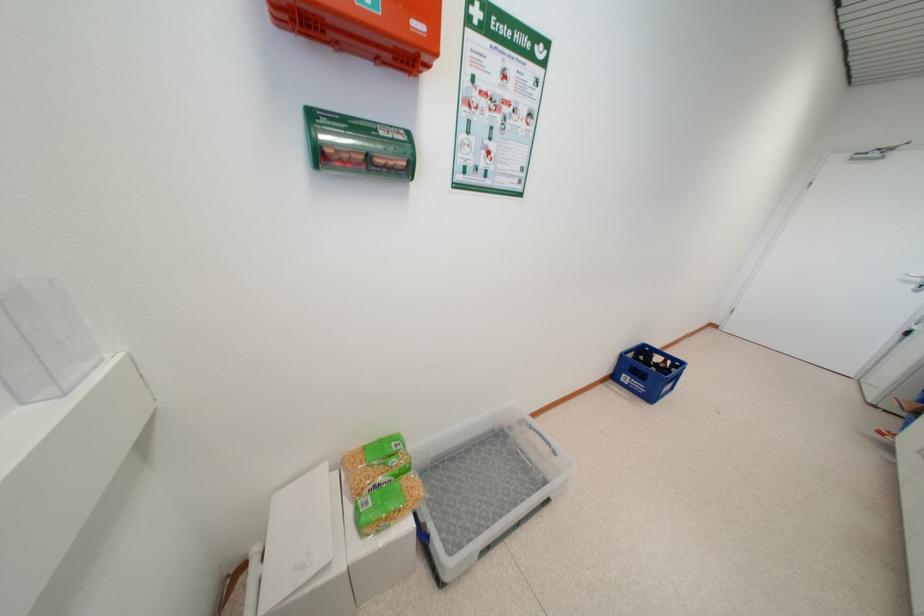
At what (x,y) coordinates should I click in order to perform the action: click on blue crate handle. Please return your answer as a coordinate pair (x, y). This screenshot has width=924, height=616. Looking at the image, I should click on (648, 371).